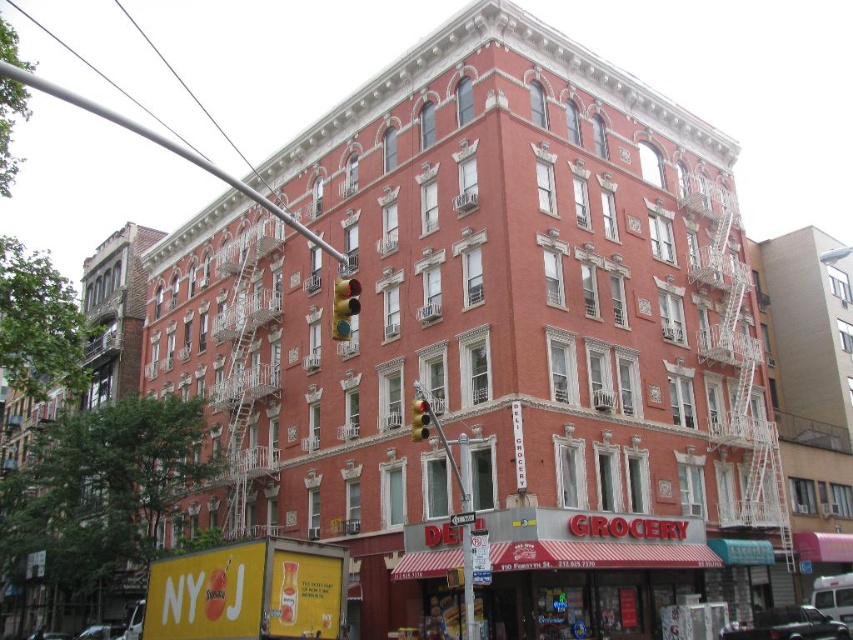
You are a pedestrian standing on the sidewalk in front of the DELI GROCERY store. You notice a metallic silver pole at upper left and a metallic yellow traffic light at center. Which object is nearer to you?

The metallic silver pole at upper left is closer to the viewer than the metallic yellow traffic light at center.

You are a city planner assessing the visibility of traffic signals in the area. Given the presence of the metallic silver pole at upper left and the yellow matte traffic light at center, which object might obstruct the view of the traffic light for drivers approaching the intersection? Please explain your reasoning based on their sizes.

The metallic silver pole at upper left is larger in size than the yellow matte traffic light at center, so it could potentially obstruct the view of the traffic light for drivers approaching the intersection due to its larger size.

You are a delivery person who needs to park your 2.5 meter wide delivery van between the metallic silver pole at upper left and the metallic yellow traffic light at center. Can you fit your van there?

The distance between the metallic silver pole at upper left and the metallic yellow traffic light at center is 77.62 meters. Since the van is only 2.5 meters wide, there is more than enough space to park it between them.